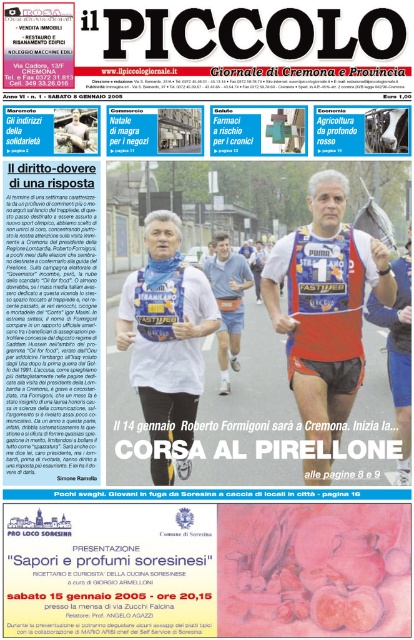
How much distance is there between blue fabric runner at center and blue fabric shirt at center?

blue fabric runner at center and blue fabric shirt at center are 3.21 meters apart.

Identify the location of blue fabric runner at center. (324, 314).

Does blue fabric runner at center come in front of white fabric vest at center?

Yes, blue fabric runner at center is in front of white fabric vest at center.

Can you confirm if blue fabric runner at center is wider than white fabric vest at center?

Indeed, blue fabric runner at center has a greater width compared to white fabric vest at center.

Who is more distant from viewer, (344,282) or (122,332)?

The point (344,282) is behind.

This screenshot has height=640, width=414. Identify the location of blue fabric runner at center. [x=324, y=314].

Is white fabric vest at center to the right of blue fabric shirt at center from the viewer's perspective?

In fact, white fabric vest at center is to the left of blue fabric shirt at center.

Image resolution: width=414 pixels, height=640 pixels. I want to click on white fabric vest at center, so click(166, 342).

You are a GUI agent. You are given a task and a screenshot of the screen. Output one action in this format:
    pyautogui.click(x=<x>, y=<y>)
    Task: Click on the white fabric vest at center
    
    Given the screenshot: What is the action you would take?
    pyautogui.click(x=166, y=342)